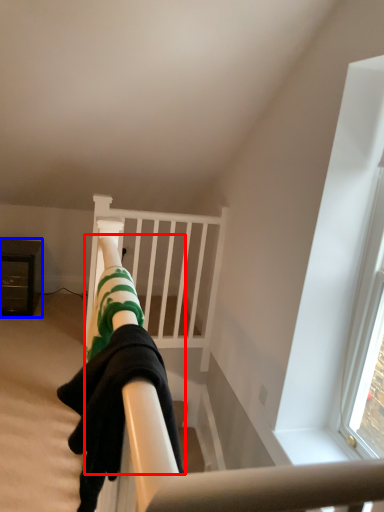
Question: Which point is closer to the camera, person (highlighted by a red box) or furniture (highlighted by a blue box)?

Choices:
 (A) person
 (B) furniture

Answer: (A)